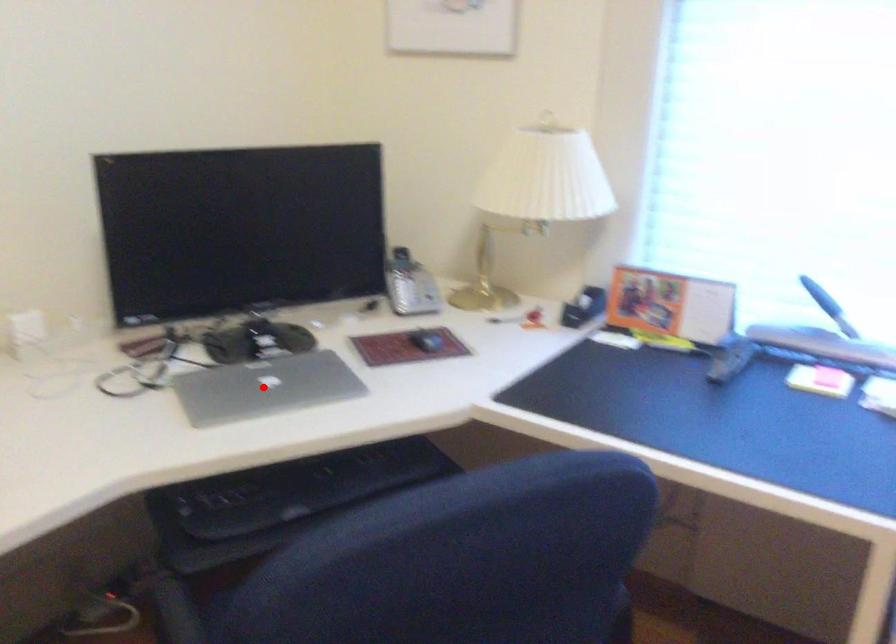
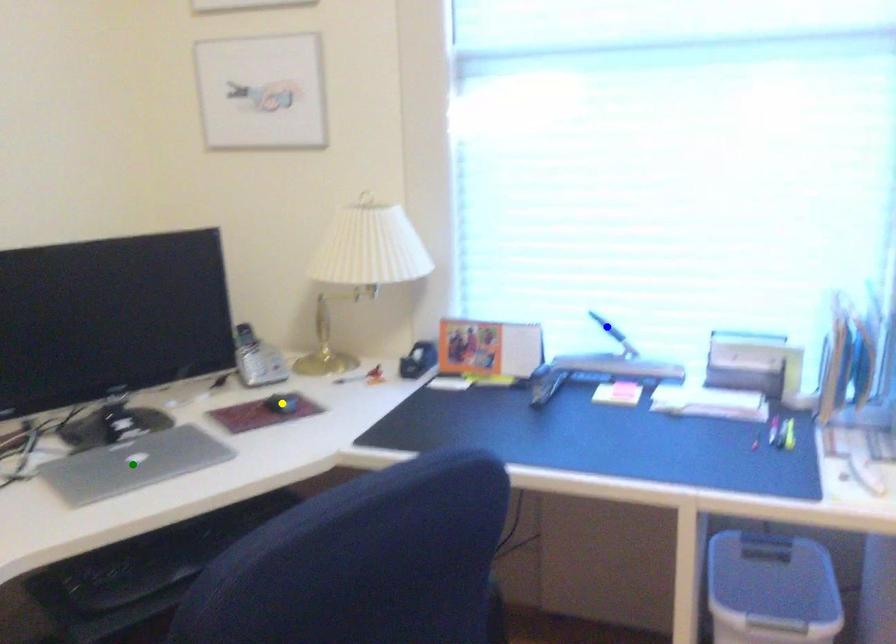
Question: I am providing you with two images of the same scene from different viewpoints. A red point is marked on the first image. You are given multiple points on the second image. Which spot in image 2 lines up with the point in image 1?

Choices:
 (A) yellow point
 (B) blue point
 (C) green point

Answer: (C)